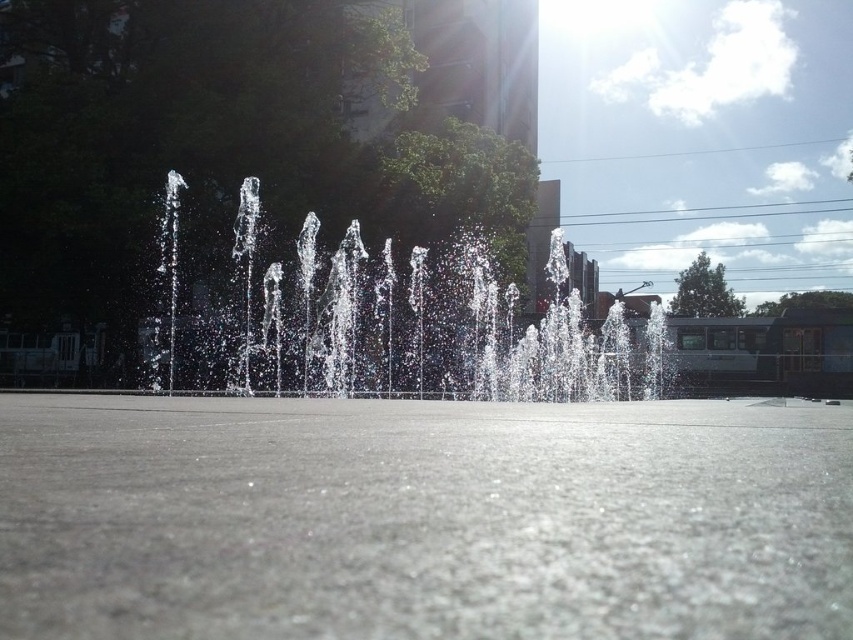
Which of these two, transparent liquid water at center or clear water at center, stands shorter?

transparent liquid water at center

Is transparent liquid water at center positioned in front of clear water at center?

Yes, it is.

Between point (729, 627) and point (419, 336), which one is positioned behind?

Point (419, 336)

You are a GUI agent. You are given a task and a screenshot of the screen. Output one action in this format:
    pyautogui.click(x=<x>, y=<y>)
    Task: Click on the transparent liquid water at center
    The image size is (853, 640).
    Given the screenshot: What is the action you would take?
    [x=422, y=518]